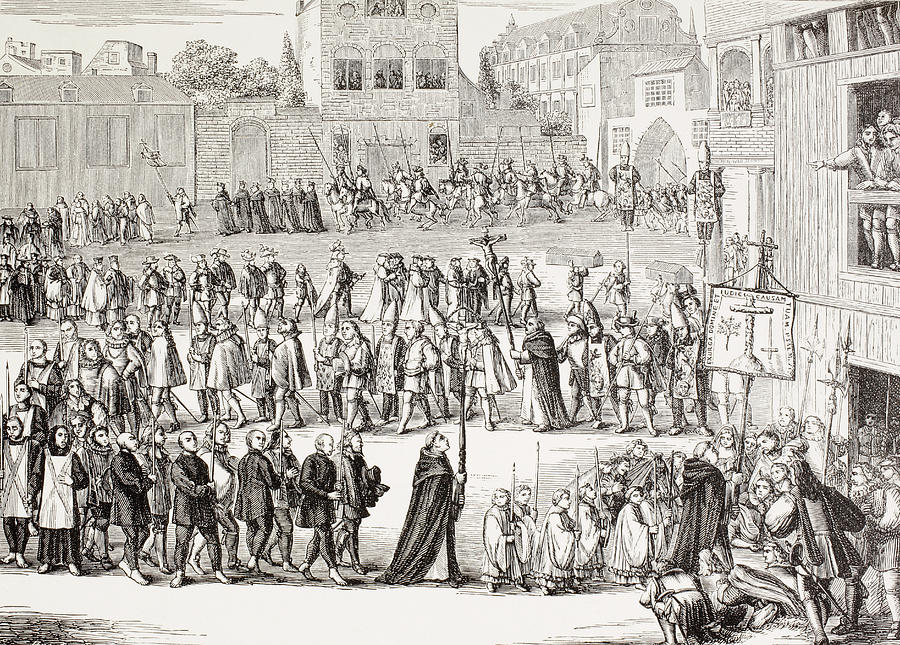
I want to click on chimney, so point(149,62), point(300,4).